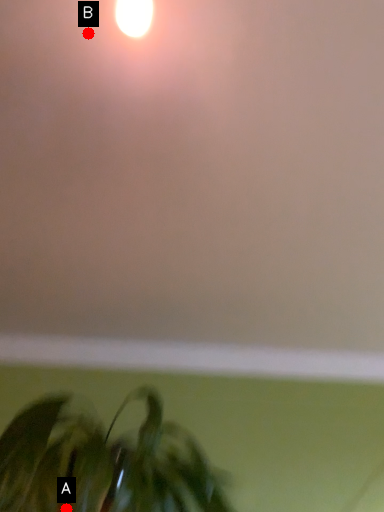
Question: Two points are circled on the image, labeled by A and B beside each circle. Which point appears farthest from the camera in this image?

Choices:
 (A) A is further
 (B) B is further

Answer: (A)